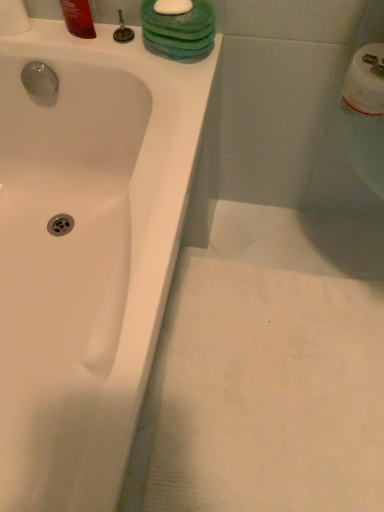
Locate an element on the screen. This screenshot has height=512, width=384. white paper towel at upper left is located at coordinates (13, 17).

I want to click on matte silver faucet at upper center, so click(x=123, y=31).

In order to click on shiny plastic bottle at upper left in this screenshot , I will do `click(78, 18)`.

Locate an element on the screen. The width and height of the screenshot is (384, 512). white paper towel at upper left is located at coordinates (13, 17).

Is white paper towel at upper left shorter than white glossy bathtub at upper left?

Indeed, white paper towel at upper left has a lesser height compared to white glossy bathtub at upper left.

Is there a large distance between white paper towel at upper left and white glossy bathtub at upper left?

No, white paper towel at upper left is in close proximity to white glossy bathtub at upper left.

In the scene shown: Visually, is white paper towel at upper left positioned to the left or to the right of white glossy bathtub at upper left?

Clearly, white paper towel at upper left is on the left of white glossy bathtub at upper left in the image.

Between point (6, 24) and point (47, 277), which one is positioned in front?

The point (6, 24) is closer.

Is point (76, 18) closer or farther from the camera than point (19, 10)?

Point (76, 18) is closer to the camera than point (19, 10).

What's the angular difference between shiny plastic bottle at upper left and white paper towel at upper left's facing directions?

There is a 0.000193-degree angle between the facing directions of shiny plastic bottle at upper left and white paper towel at upper left.

Considering the sizes of objects shiny plastic bottle at upper left and white paper towel at upper left in the image provided, who is smaller, shiny plastic bottle at upper left or white paper towel at upper left?

Smaller between the two is shiny plastic bottle at upper left.

Considering the relative positions of shiny plastic bottle at upper left and white paper towel at upper left in the image provided, is shiny plastic bottle at upper left to the left or to the right of white paper towel at upper left?

From the image, it's evident that shiny plastic bottle at upper left is to the right of white paper towel at upper left.

From the image's perspective, is matte silver faucet at upper center below white paper towel at upper left?

Indeed, from the image's perspective, matte silver faucet at upper center is shown beneath white paper towel at upper left.

From a real-world perspective, is matte silver faucet at upper center beneath white paper towel at upper left?

Yes.

Does point (120, 30) lie behind point (24, 29)?

No, (120, 30) is closer to viewer.

Which of these two, white paper towel at upper left or matte silver faucet at upper center, stands shorter?

With less height is matte silver faucet at upper center.

Considering the sizes of objects white paper towel at upper left and matte silver faucet at upper center in the image provided, who is smaller, white paper towel at upper left or matte silver faucet at upper center?

matte silver faucet at upper center is smaller.

Does white paper towel at upper left turn towards matte silver faucet at upper center?

No, white paper towel at upper left is not oriented towards matte silver faucet at upper center.

Can you tell me how much white paper towel at upper left and matte silver faucet at upper center differ in facing direction?

The facing directions of white paper towel at upper left and matte silver faucet at upper center are 0.000544 degrees apart.

From the image's perspective, is white glossy bathtub at upper left above matte silver faucet at upper center?

No, from the image's perspective, white glossy bathtub at upper left is not on top of matte silver faucet at upper center.

Between white glossy bathtub at upper left and matte silver faucet at upper center, which one has less height?

Standing shorter between the two is matte silver faucet at upper center.

Is point (22, 454) closer to viewer compared to point (124, 24)?

Yes, it is in front of point (124, 24).

From a real-world perspective, is white glossy bathtub at upper left above or below matte silver faucet at upper center?

From a real-world perspective, white glossy bathtub at upper left is physically below matte silver faucet at upper center.

From the image's perspective, is matte silver faucet at upper center beneath shiny plastic bottle at upper left?

Yes.

Are matte silver faucet at upper center and shiny plastic bottle at upper left making contact?

Yes, matte silver faucet at upper center is in contact with shiny plastic bottle at upper left.

How many degrees apart are the facing directions of matte silver faucet at upper center and shiny plastic bottle at upper left?

0.000354 degrees separate the facing orientations of matte silver faucet at upper center and shiny plastic bottle at upper left.

Is the depth of matte silver faucet at upper center less than that of shiny plastic bottle at upper left?

No, matte silver faucet at upper center is further to the viewer.

Is matte silver faucet at upper center in front of or behind white glossy bathtub at upper left in the image?

Visually, matte silver faucet at upper center is located behind white glossy bathtub at upper left.

Considering the sizes of objects matte silver faucet at upper center and white glossy bathtub at upper left in the image provided, who is shorter, matte silver faucet at upper center or white glossy bathtub at upper left?

matte silver faucet at upper center is shorter.

Considering the sizes of objects matte silver faucet at upper center and white glossy bathtub at upper left in the image provided, who is thinner, matte silver faucet at upper center or white glossy bathtub at upper left?

matte silver faucet at upper center is thinner.

Where is `bathtub on the right of the white paper towel at upper left`? bathtub on the right of the white paper towel at upper left is located at coordinates (86, 254).

Where is `liquid below the white paper towel at upper left (from the image's perspective)`? This screenshot has height=512, width=384. liquid below the white paper towel at upper left (from the image's perspective) is located at coordinates (78, 18).

Estimate the real-world distances between objects in this image. Which object is closer to white paper towel at upper left, matte silver faucet at upper center or shiny plastic bottle at upper left?

Among the two, shiny plastic bottle at upper left is located nearer to white paper towel at upper left.

When comparing their distances from matte silver faucet at upper center, does white paper towel at upper left or white glossy bathtub at upper left seem closer?

Among the two, white paper towel at upper left is located nearer to matte silver faucet at upper center.

When comparing their distances from white paper towel at upper left, does shiny plastic bottle at upper left or white glossy bathtub at upper left seem further?

white glossy bathtub at upper left lies further to white paper towel at upper left than the other object.

Which object lies nearer to the anchor point white glossy bathtub at upper left, shiny plastic bottle at upper left or matte silver faucet at upper center?

Among the two, shiny plastic bottle at upper left is located nearer to white glossy bathtub at upper left.

Which object lies nearer to the anchor point matte silver faucet at upper center, shiny plastic bottle at upper left or white glossy bathtub at upper left?

shiny plastic bottle at upper left lies closer to matte silver faucet at upper center than the other object.

From the image, which object appears to be farther from matte silver faucet at upper center, white glossy bathtub at upper left or shiny plastic bottle at upper left?

Among the two, white glossy bathtub at upper left is located further to matte silver faucet at upper center.

Which object lies further to the anchor point white paper towel at upper left, white glossy bathtub at upper left or matte silver faucet at upper center?

white glossy bathtub at upper left.

In the scene shown: Based on their spatial positions, is white paper towel at upper left or matte silver faucet at upper center further from shiny plastic bottle at upper left?

The object further to shiny plastic bottle at upper left is white paper towel at upper left.

At what (x,y) coordinates should I click in order to perform the action: click on liquid between white paper towel at upper left and matte silver faucet at upper center from left to right. Please return your answer as a coordinate pair (x, y). The width and height of the screenshot is (384, 512). Looking at the image, I should click on [78, 18].

Locate an element on the screen. This screenshot has width=384, height=512. liquid that lies between white paper towel at upper left and white glossy bathtub at upper left from top to bottom is located at coordinates click(78, 18).

Locate an element on the screen. plumbing fixture that lies between white paper towel at upper left and white glossy bathtub at upper left from top to bottom is located at coordinates (123, 31).

The width and height of the screenshot is (384, 512). Find the location of `plumbing fixture between shiny plastic bottle at upper left and white glossy bathtub at upper left from top to bottom`. plumbing fixture between shiny plastic bottle at upper left and white glossy bathtub at upper left from top to bottom is located at coordinates (123, 31).